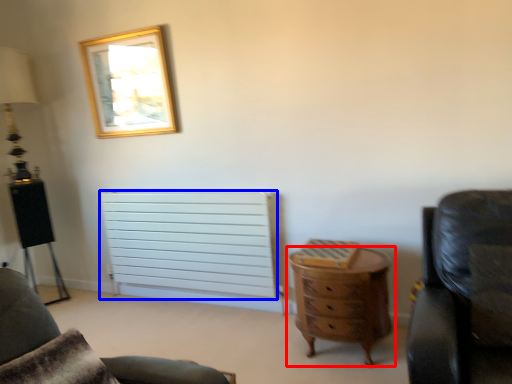
Question: Which object appears farthest to the camera in this image, chest of drawers (highlighted by a red box) or radiator (highlighted by a blue box)?

Choices:
 (A) chest of drawers
 (B) radiator

Answer: (B)